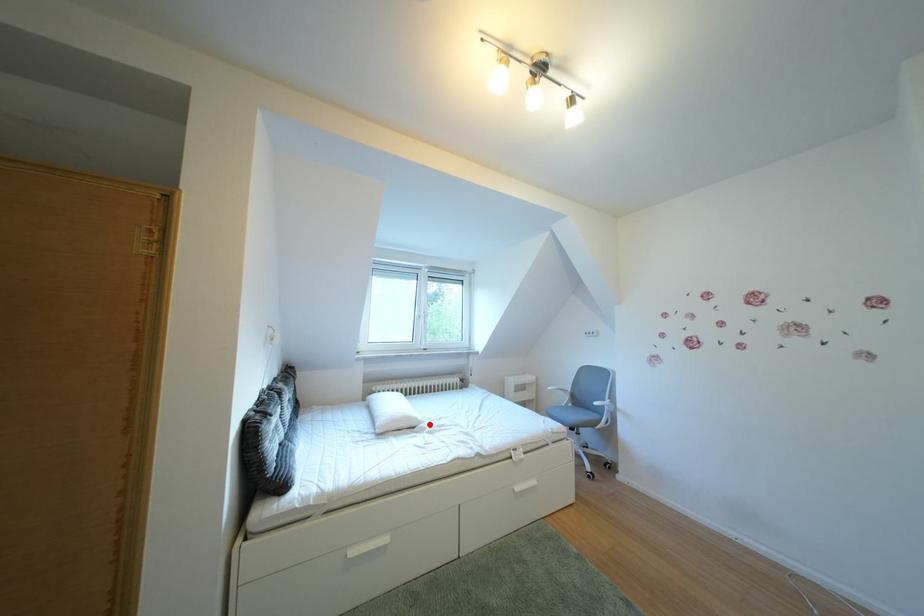
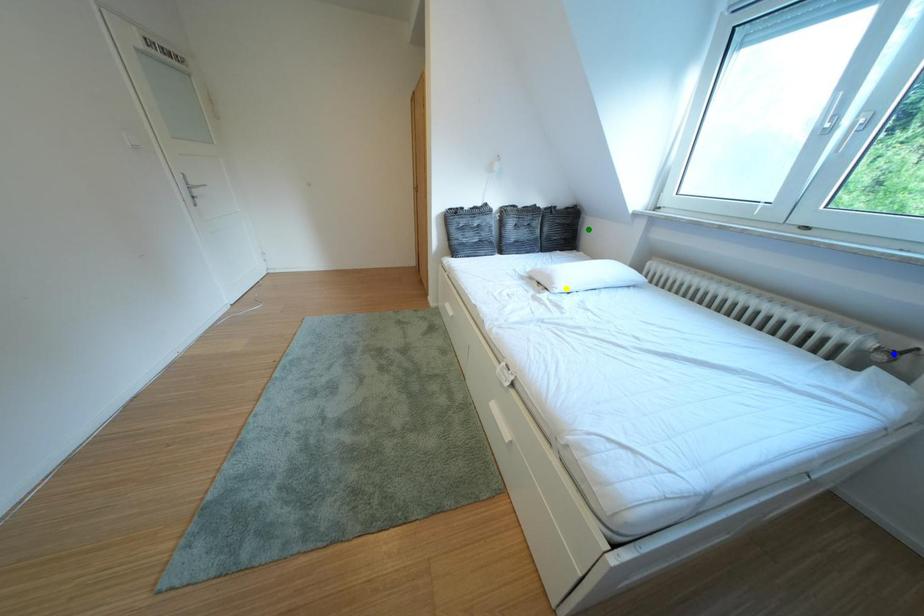
Question: I am providing you with two images of the same scene from different viewpoints. A red point is marked on the first image. You are given multiple points on the second image. In image 2, which mark is for the same physical point as the one in image 1?

Choices:
 (A) yellow point
 (B) green point
 (C) blue point

Answer: (A)